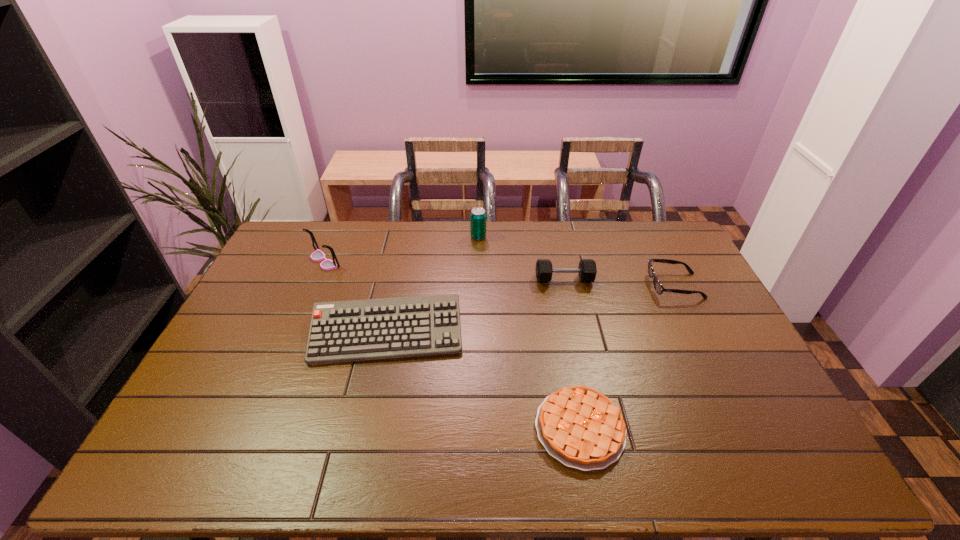
Image resolution: width=960 pixels, height=540 pixels. What are the coordinates of `vacant space that is in between the shortest object and the computer keyboard` in the screenshot? It's located at (484, 381).

Image resolution: width=960 pixels, height=540 pixels. Identify the location of free space that is in between the right spectacles and the fifth farthest object. (531, 310).

At what (x,y) coordinates should I click in order to perform the action: click on empty space that is in between the right spectacles and the computer keyboard. Please return your answer as a coordinate pair (x, y). This screenshot has width=960, height=540. Looking at the image, I should click on (531, 310).

The image size is (960, 540). I want to click on vacant space in between the farthest object and the taller spectacles, so click(x=401, y=249).

Find the location of a particular element. Image resolution: width=960 pixels, height=540 pixels. free space between the fifth farthest object and the third object from left to right is located at coordinates (433, 286).

This screenshot has height=540, width=960. Identify the location of free area in between the nearest object and the beer can. (529, 333).

Where is `free space between the fourth object from right to left and the left spectacles`? Image resolution: width=960 pixels, height=540 pixels. free space between the fourth object from right to left and the left spectacles is located at coordinates (401, 249).

Where is `object that is the second closest to the taller spectacles`? This screenshot has width=960, height=540. object that is the second closest to the taller spectacles is located at coordinates (478, 215).

Select which object appears as the fifth closest to the nearest object. Please provide its 2D coordinates. Your answer should be formatted as a tuple, i.e. [(x, y)], where the tuple contains the x and y coordinates of a point satisfying the conditions above.

[(318, 255)]

The image size is (960, 540). I want to click on vacant space that satisfies the following two spatial constraints: 1. on the front side of the beer can; 2. on the right side of the dumbbell, so pyautogui.click(x=478, y=280).